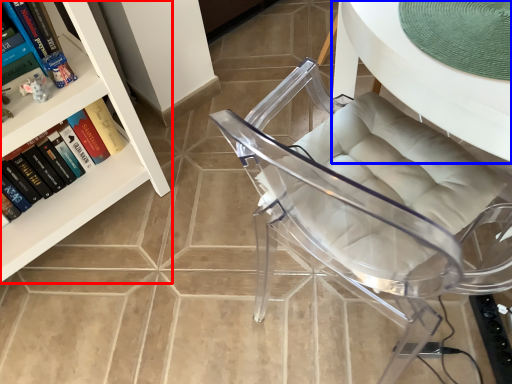
Question: Which of the following is the closest to the observer, bookcase (highlighted by a red box) or table (highlighted by a blue box)?

Choices:
 (A) bookcase
 (B) table

Answer: (B)